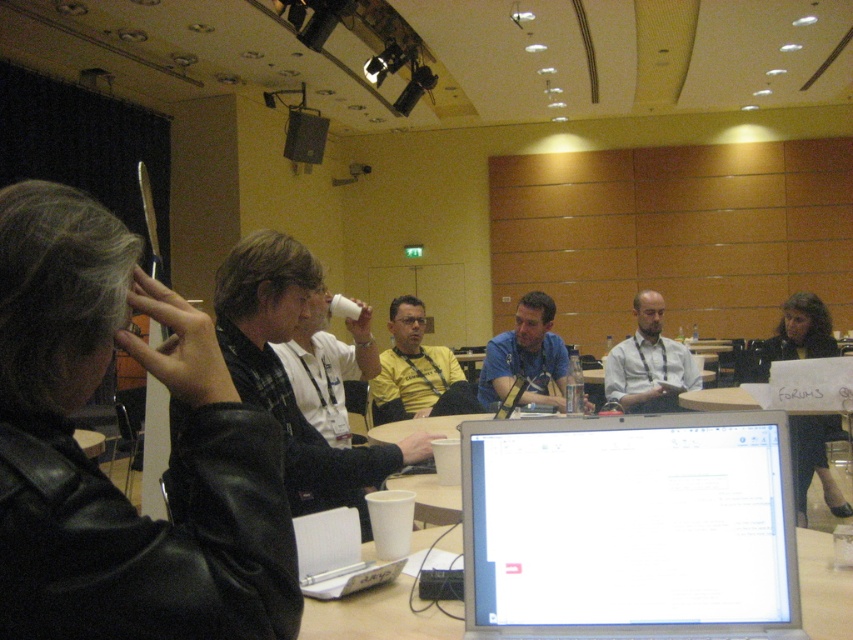
You are a participant in the meeting and need to access the silver metallic laptop at center to present your slides. However, there is a white matte cup at center in the way. Can you reach the laptop without moving the cup?

The silver metallic laptop at center is positioned under the white matte cup at center, so you can reach the laptop by moving your hand under the cup without needing to move it.